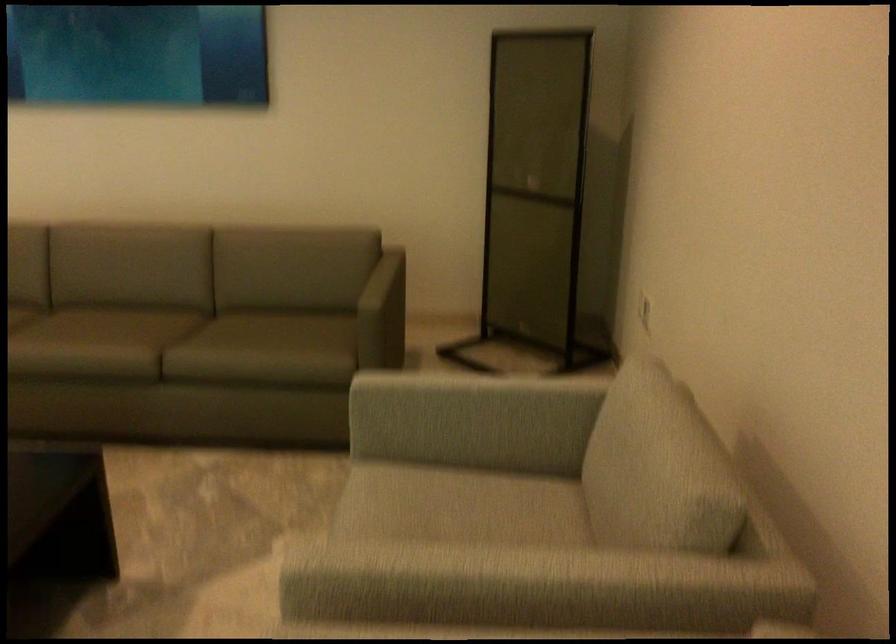
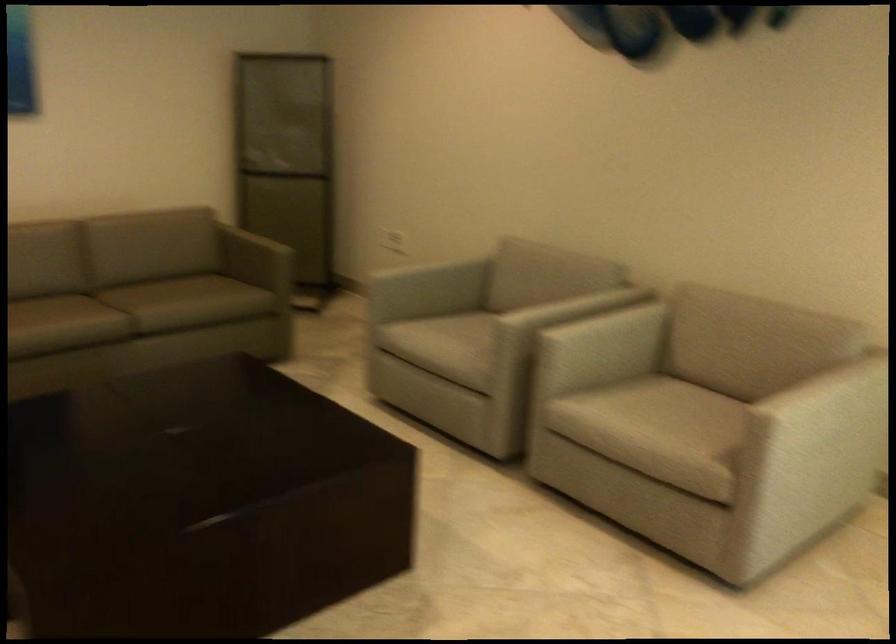
Find the pixel in the second image that matches the point at 479,573 in the first image.

(548, 304)